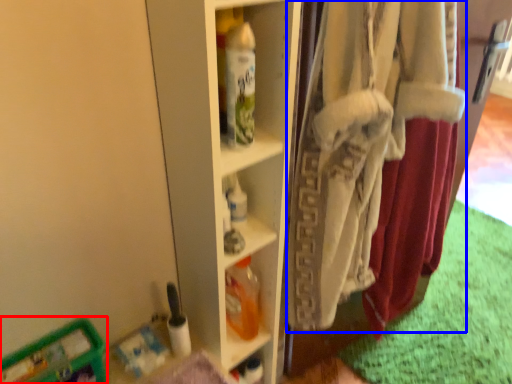
Question: Which object is closer to the camera taking this photo, wide (highlighted by a red box) or underclothes (highlighted by a blue box)?

Choices:
 (A) wide
 (B) underclothes

Answer: (B)